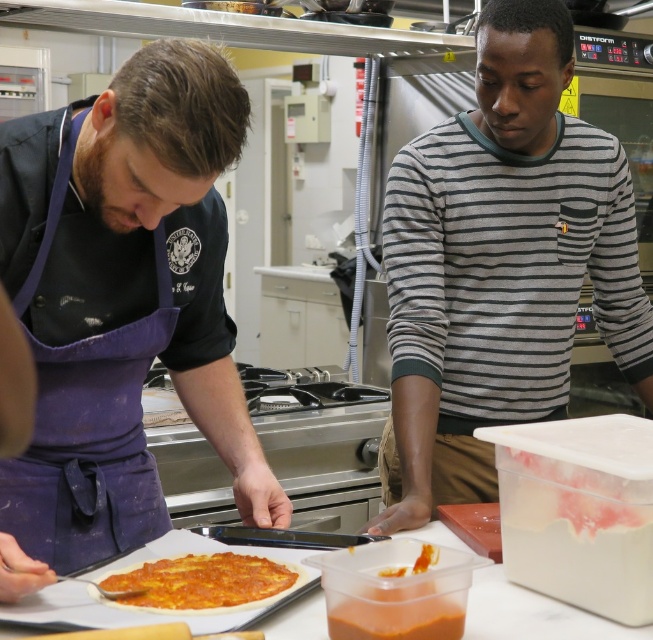
Who is positioned more to the left, smooth orange sauce at center or yellow cheese pizza at center?

yellow cheese pizza at center is more to the left.

Which is below, smooth orange sauce at center or yellow cheese pizza at center?

yellow cheese pizza at center is lower down.

Is point (417, 580) closer to viewer compared to point (274, 563)?

Yes, it is in front of point (274, 563).

Find the location of a particular element. The image size is (653, 640). smooth orange sauce at center is located at coordinates (394, 592).

Is gray striped sweater at center smaller than smooth orange sauce at center?

No.

Which is in front, point (422, 141) or point (460, 580)?

Point (460, 580) is in front.

This screenshot has height=640, width=653. I want to click on gray striped sweater at center, so click(500, 266).

Who is higher up, purple apron at left or smooth orange sauce at center?

purple apron at left

Who is more distant from viewer, (x=148, y=100) or (x=426, y=620)?

Point (x=148, y=100)

At what (x,y) coordinates should I click in order to perform the action: click on purple apron at left. Please return your answer as a coordinate pair (x, y). The image size is (653, 640). Looking at the image, I should click on (121, 305).